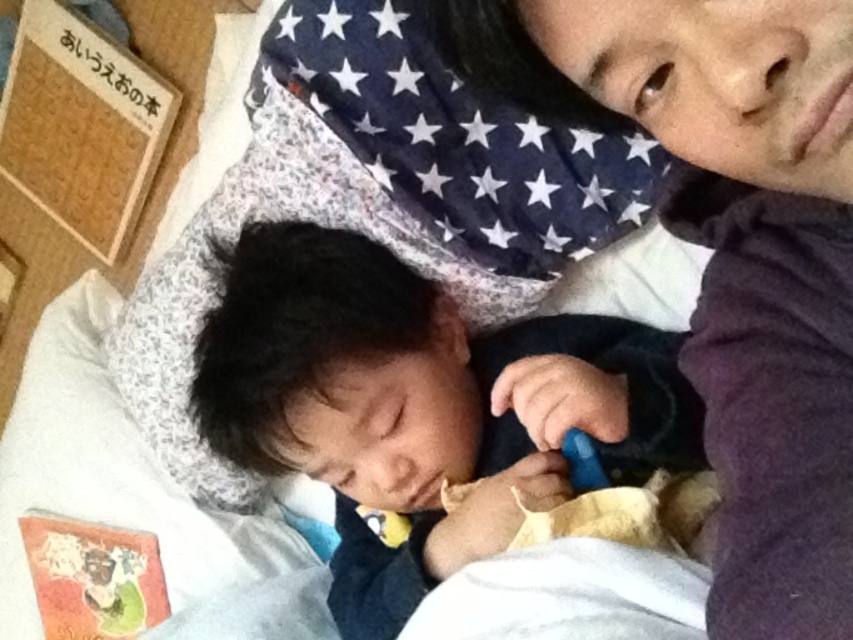
Looking at this image, does purple soft fabric at upper right appear under black soft baby at center?

Actually, purple soft fabric at upper right is above black soft baby at center.

Is purple soft fabric at upper right taller than black soft baby at center?

In fact, purple soft fabric at upper right may be shorter than black soft baby at center.

Between point (637, 124) and point (648, 355), which one is positioned behind?

Positioned behind is point (648, 355).

Find the location of a particular element. The height and width of the screenshot is (640, 853). purple soft fabric at upper right is located at coordinates [x=730, y=252].